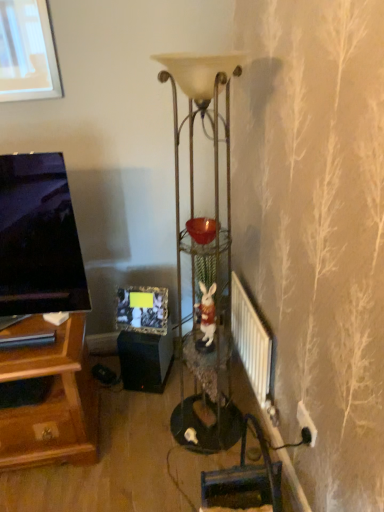
Identify the location of vacant region below matte black picture frame at center (from a real-world perspective). Image resolution: width=384 pixels, height=512 pixels. (140, 336).